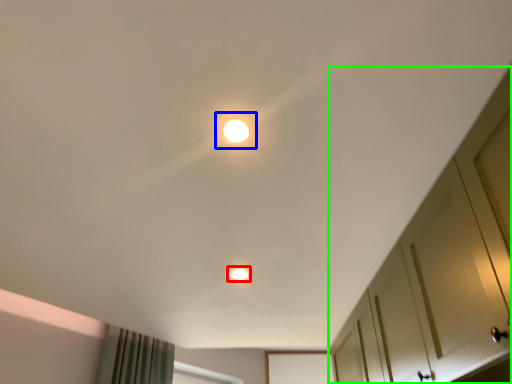
Question: Estimate the real-world distances between objects in this image. Which object is farther from dot (highlighted by a red box), dot (highlighted by a blue box) or dresser (highlighted by a green box)?

Choices:
 (A) dot
 (B) dresser

Answer: (A)